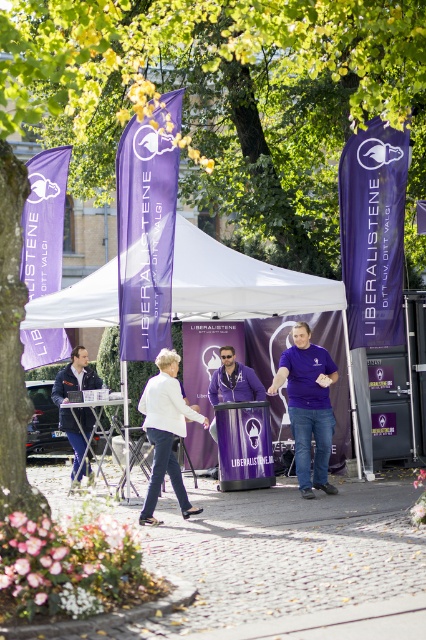
Question: Which point is farther to the camera?

Choices:
 (A) purple matte jacket at center
 (B) matte purple podium at center

Answer: (A)

Question: Does white fabric canopy at center appear on the left side of matte purple podium at center?

Choices:
 (A) no
 (B) yes

Answer: (A)

Question: Does purple cotton shirt at center have a lesser width compared to matte purple podium at center?

Choices:
 (A) no
 (B) yes

Answer: (B)

Question: Which of the following is the farthest from the observer?

Choices:
 (A) (293, 362)
 (B) (154, 376)
 (C) (100, 403)

Answer: (C)

Question: Is white fabric tent at center wider than purple matte jacket at center?

Choices:
 (A) yes
 (B) no

Answer: (A)

Question: Considering the real-world distances, which object is farthest from the purple matte jacket at center?

Choices:
 (A) dark blue jacket at left
 (B) purple cotton shirt at center
 (C) matte purple podium at center

Answer: (B)